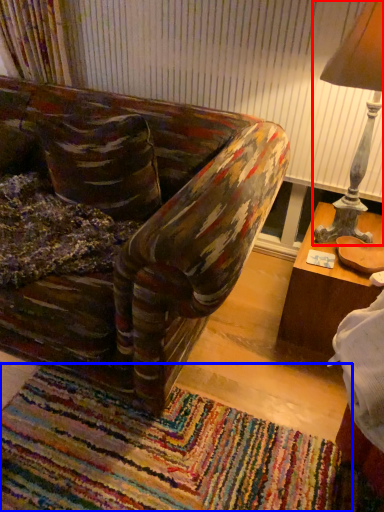
Question: Which point is closer to the camera, table lamp (highlighted by a red box) or mat (highlighted by a blue box)?

Choices:
 (A) table lamp
 (B) mat

Answer: (B)